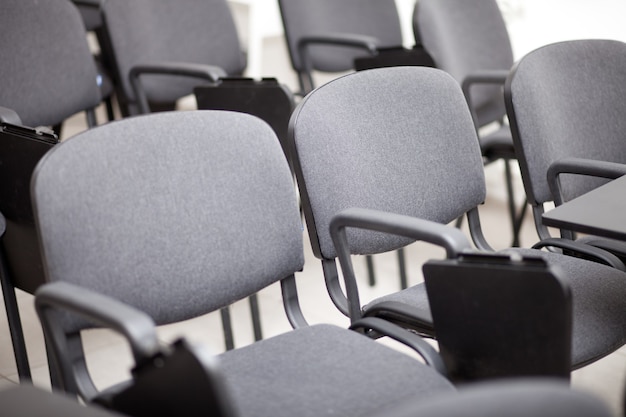
Image resolution: width=626 pixels, height=417 pixels. In order to click on chairs in this screenshot , I will do `click(200, 223)`, `click(314, 400)`, `click(389, 178)`, `click(598, 287)`, `click(608, 109)`, `click(458, 51)`, `click(504, 140)`, `click(360, 24)`, `click(182, 22)`, `click(53, 57)`.